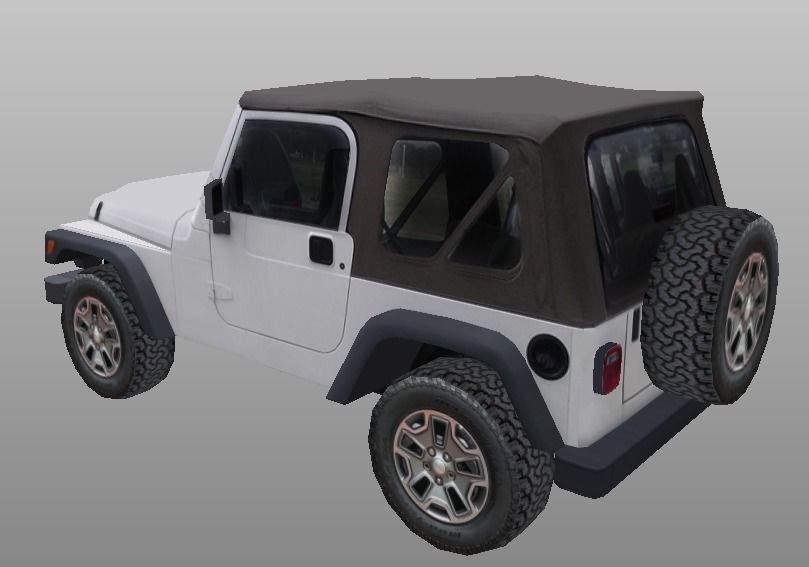
The height and width of the screenshot is (567, 809). I want to click on back light, so click(x=608, y=380).